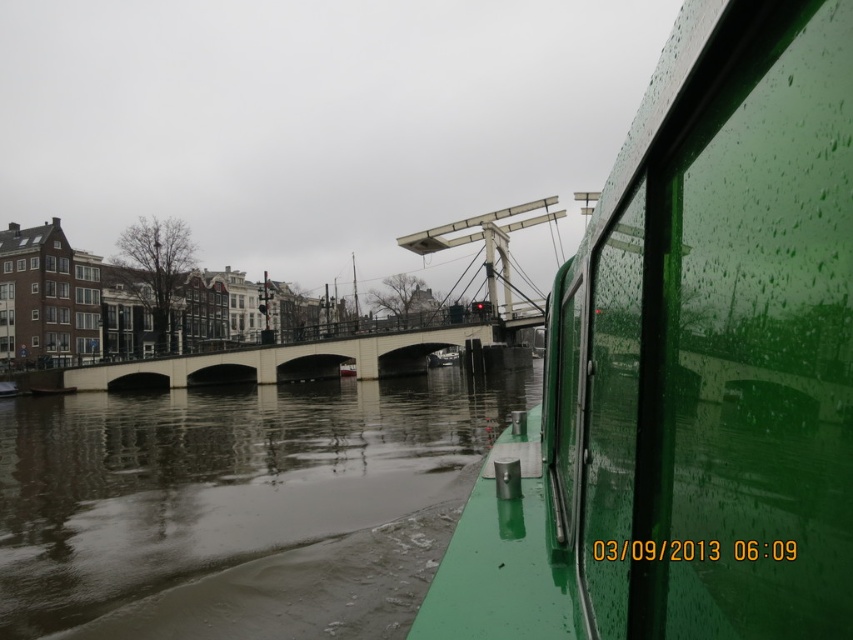
You are on a boat in Amsterdam and want to know if the smooth water at center is higher or lower than the white concrete bridge at center. Based on the scene, can you determine this?

The smooth water at center is not as tall as the white concrete bridge at center, so the water is lower than the bridge.

You are standing on the boat and looking out towards the canal. There are two points marked on the boat and its surroundings. The first point is located at coordinates point(285, 534) and the second at point(383, 340). Which of these two points is closer to you?

Point(285, 534) is in front of point(383, 340), so it is closer to you.